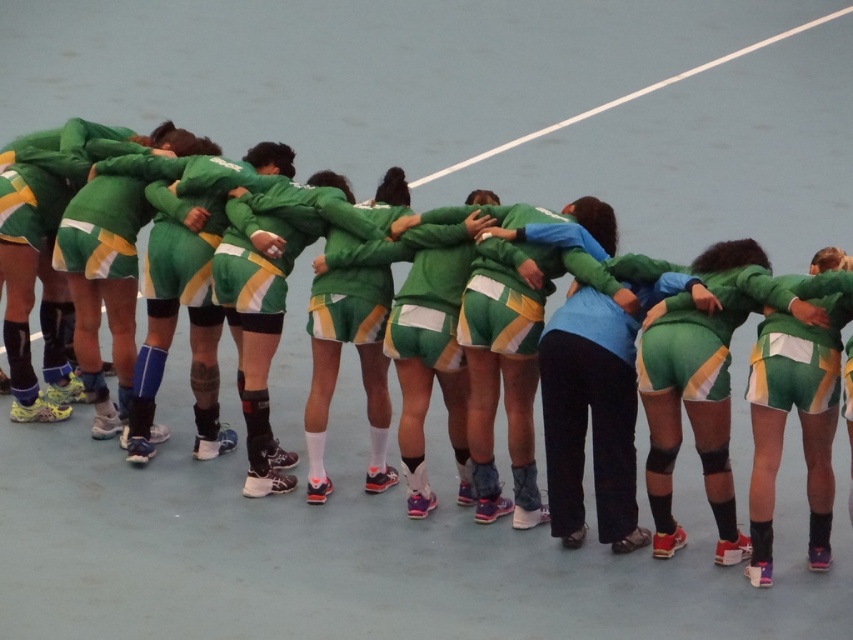
Question: Which point is farther from the camera taking this photo?

Choices:
 (A) (784, 349)
 (B) (326, 307)

Answer: (B)

Question: In this image, where is green matte jersey at center located relative to white line at upper center?

Choices:
 (A) right
 (B) left

Answer: (B)

Question: Can you confirm if green jersey at center is positioned above white line at upper center?

Choices:
 (A) no
 (B) yes

Answer: (A)

Question: Which is nearer to the green matte jersey at center?

Choices:
 (A) green jersey at center
 (B) white line at upper center

Answer: (A)

Question: Can you confirm if green matte jersey at center is bigger than white line at upper center?

Choices:
 (A) no
 (B) yes

Answer: (A)

Question: Among these objects, which one is farthest from the camera?

Choices:
 (A) green matte jersey at center
 (B) white line at upper center
 (C) green jersey at center

Answer: (B)